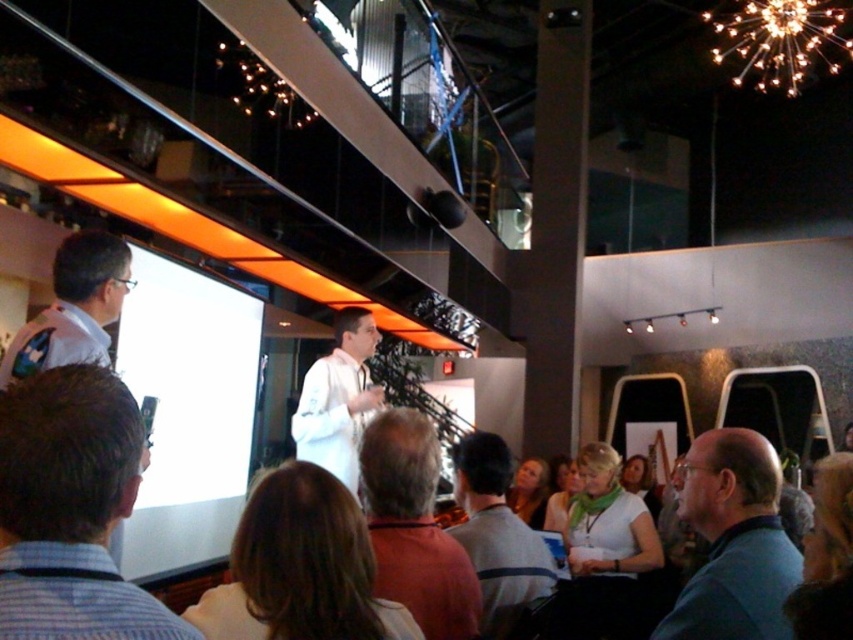
You are standing at the front of the conference room and notice two points marked on the projection screen. The first point is at coordinates point (416, 461) and the second is at point (329, 368). Which point appears closer to you?

Point (416, 461) is closer to the camera than point (329, 368), so the first point appears closer to you.